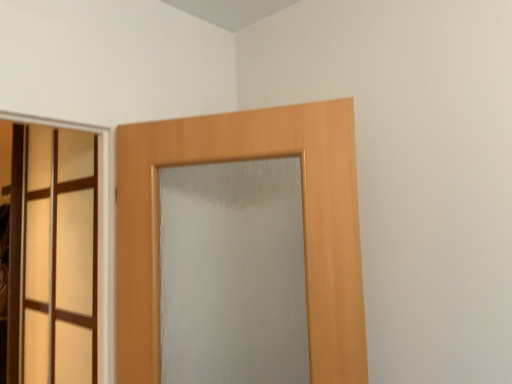
What are the coordinates of `translucent glass door at left, marked as the 1th door in a back-to-front arrangement` in the screenshot? It's located at (53, 255).

The image size is (512, 384). What do you see at coordinates (53, 255) in the screenshot? I see `translucent glass door at left, marked as the 1th door in a back-to-front arrangement` at bounding box center [53, 255].

Locate an element on the screen. wooden door at center, which appears as the 1th door when viewed from the right is located at coordinates (303, 225).

Describe the element at coordinates (303, 225) in the screenshot. I see `wooden door at center, which appears as the 1th door when viewed from the right` at that location.

I want to click on translucent glass door at left, marked as the second door in a front-to-back arrangement, so click(53, 255).

Between wooden door at center, marked as the 2th door in a back-to-front arrangement, and translucent glass door at left, the first door positioned from the left, which one appears on the left side from the viewer's perspective?

translucent glass door at left, the first door positioned from the left, is more to the left.

Who is more distant, wooden door at center, marked as the 2th door in a back-to-front arrangement, or translucent glass door at left, acting as the second door starting from the right?

translucent glass door at left, acting as the second door starting from the right.

Is point (132, 284) positioned behind point (42, 245)?

No, (132, 284) is closer to viewer.

From the image's perspective, is wooden door at center, the second door from the left, under translucent glass door at left, acting as the second door starting from the right?

Incorrect, from the image's perspective, wooden door at center, the second door from the left, is higher than translucent glass door at left, acting as the second door starting from the right.

From a real-world perspective, is wooden door at center, arranged as the first door when viewed from the front, under translucent glass door at left, acting as the second door starting from the right?

Actually, wooden door at center, arranged as the first door when viewed from the front, is physically above translucent glass door at left, acting as the second door starting from the right, in the real world.

Does wooden door at center, arranged as the first door when viewed from the front, have a lesser width compared to translucent glass door at left, marked as the 1th door in a back-to-front arrangement?

In fact, wooden door at center, arranged as the first door when viewed from the front, might be wider than translucent glass door at left, marked as the 1th door in a back-to-front arrangement.

Who is taller, wooden door at center, arranged as the first door when viewed from the front, or translucent glass door at left, marked as the 1th door in a back-to-front arrangement?

translucent glass door at left, marked as the 1th door in a back-to-front arrangement, is taller.

Who is bigger, wooden door at center, the second door from the left, or translucent glass door at left, marked as the second door in a front-to-back arrangement?

With larger size is translucent glass door at left, marked as the second door in a front-to-back arrangement.

Which is correct: wooden door at center, arranged as the first door when viewed from the front, is inside translucent glass door at left, marked as the 1th door in a back-to-front arrangement, or outside of it?

wooden door at center, arranged as the first door when viewed from the front, is located beyond the bounds of translucent glass door at left, marked as the 1th door in a back-to-front arrangement.

Is wooden door at center, arranged as the first door when viewed from the front, touching translucent glass door at left, the first door positioned from the left?

No, wooden door at center, arranged as the first door when viewed from the front, is not beside translucent glass door at left, the first door positioned from the left.

Is wooden door at center, the second door from the left, oriented away from translucent glass door at left, marked as the second door in a front-to-back arrangement?

That's not correct — wooden door at center, the second door from the left, is not looking away from translucent glass door at left, marked as the second door in a front-to-back arrangement.

Measure the distance between wooden door at center, arranged as the first door when viewed from the front, and translucent glass door at left, marked as the second door in a front-to-back arrangement.

A distance of 26.00 inches exists between wooden door at center, arranged as the first door when viewed from the front, and translucent glass door at left, marked as the second door in a front-to-back arrangement.

This screenshot has height=384, width=512. Find the location of `door directly beneath the wooden door at center, the second door from the left (from a real-world perspective)`. door directly beneath the wooden door at center, the second door from the left (from a real-world perspective) is located at coordinates (53, 255).

Is translucent glass door at left, marked as the 1th door in a back-to-front arrangement, at the right side of wooden door at center, the second door from the left?

No.

Which object is further away from the camera taking this photo, translucent glass door at left, marked as the 1th door in a back-to-front arrangement, or wooden door at center, marked as the 2th door in a back-to-front arrangement?

translucent glass door at left, marked as the 1th door in a back-to-front arrangement, is further away from the camera.

Does point (66, 232) lie in front of point (137, 252)?

No, (66, 232) is behind (137, 252).

Consider the image. From the image's perspective, does translucent glass door at left, acting as the second door starting from the right, appear lower than wooden door at center, marked as the 2th door in a back-to-front arrangement?

Yes, from the image's perspective, translucent glass door at left, acting as the second door starting from the right, is beneath wooden door at center, marked as the 2th door in a back-to-front arrangement.

From a real-world perspective, is translucent glass door at left, the first door positioned from the left, located higher than wooden door at center, marked as the 2th door in a back-to-front arrangement?

No, from a real-world perspective, translucent glass door at left, the first door positioned from the left, is not on top of wooden door at center, marked as the 2th door in a back-to-front arrangement.

Considering the sizes of objects translucent glass door at left, the first door positioned from the left, and wooden door at center, marked as the 2th door in a back-to-front arrangement, in the image provided, who is wider, translucent glass door at left, the first door positioned from the left, or wooden door at center, marked as the 2th door in a back-to-front arrangement,?

Wider between the two is wooden door at center, marked as the 2th door in a back-to-front arrangement.

Does translucent glass door at left, marked as the second door in a front-to-back arrangement, have a lesser height compared to wooden door at center, which appears as the 1th door when viewed from the right?

No, translucent glass door at left, marked as the second door in a front-to-back arrangement, is not shorter than wooden door at center, which appears as the 1th door when viewed from the right.

Considering the relative sizes of translucent glass door at left, marked as the 1th door in a back-to-front arrangement, and wooden door at center, arranged as the first door when viewed from the front, in the image provided, is translucent glass door at left, marked as the 1th door in a back-to-front arrangement, smaller than wooden door at center, arranged as the first door when viewed from the front,?

No, translucent glass door at left, marked as the 1th door in a back-to-front arrangement, is not smaller than wooden door at center, arranged as the first door when viewed from the front.

Is translucent glass door at left, marked as the second door in a front-to-back arrangement, outside of wooden door at center, which appears as the 1th door when viewed from the right?

Indeed, translucent glass door at left, marked as the second door in a front-to-back arrangement, is completely outside wooden door at center, which appears as the 1th door when viewed from the right.

Is translucent glass door at left, marked as the 1th door in a back-to-front arrangement, directly adjacent to wooden door at center, arranged as the first door when viewed from the front?

No.

Is translucent glass door at left, the first door positioned from the left, oriented towards wooden door at center, marked as the 2th door in a back-to-front arrangement?

No, translucent glass door at left, the first door positioned from the left, is not facing towards wooden door at center, marked as the 2th door in a back-to-front arrangement.

You are a GUI agent. You are given a task and a screenshot of the screen. Output one action in this format:
    pyautogui.click(x=<x>, y=<y>)
    Task: Click on the door on the left of wooden door at center, the second door from the left
    
    Given the screenshot: What is the action you would take?
    pyautogui.click(x=53, y=255)

The image size is (512, 384). I want to click on door behind the wooden door at center, arranged as the first door when viewed from the front, so pos(53,255).

Identify the location of door on the left of wooden door at center, marked as the 2th door in a back-to-front arrangement. (53, 255).